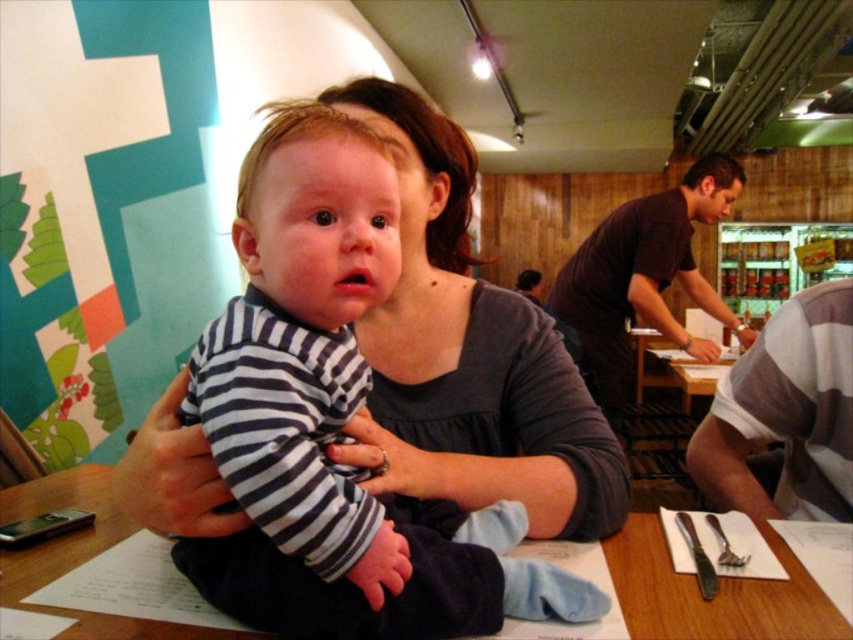
Can you confirm if gray striped shirt at lower right is bigger than dark brown shirt at center?

No.

Based on the photo, does gray striped shirt at lower right have a smaller size compared to dark brown shirt at center?

Yes.

Is point (764, 412) positioned behind point (683, 285)?

No, it is not.

Locate an element on the screen. The height and width of the screenshot is (640, 853). gray striped shirt at lower right is located at coordinates (785, 413).

Who is positioned more to the right, wooden table at center or dark brown shirt at center?

dark brown shirt at center

Can you confirm if wooden table at center is thinner than dark brown shirt at center?

Indeed, wooden table at center has a lesser width compared to dark brown shirt at center.

Between point (677, 602) and point (572, 342), which one is positioned behind?

The point (572, 342) is more distant.

This screenshot has height=640, width=853. I want to click on wooden table at center, so click(x=715, y=595).

Measure the distance between striped cotton shirt at center and gray striped shirt at lower right.

The distance of striped cotton shirt at center from gray striped shirt at lower right is 23.45 inches.

Is striped cotton shirt at center below gray striped shirt at lower right?

Incorrect, striped cotton shirt at center is not positioned below gray striped shirt at lower right.

Is point (265, 618) positioned in front of point (833, 321)?

That is True.

The image size is (853, 640). Find the location of `striped cotton shirt at center`. striped cotton shirt at center is located at coordinates (334, 420).